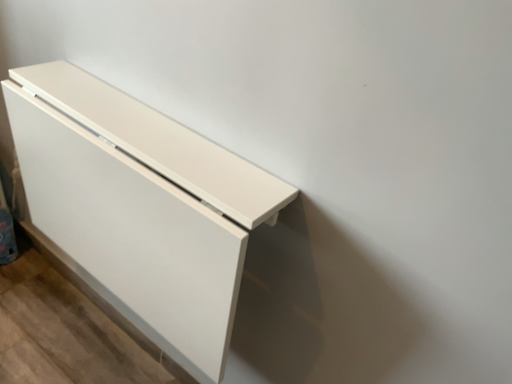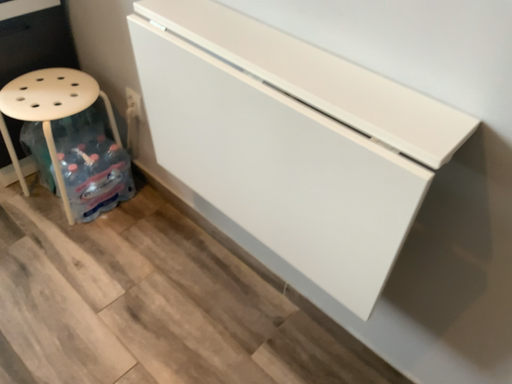
Question: Which way did the camera rotate in the video?

Choices:
 (A) rotated right
 (B) rotated left

Answer: (B)